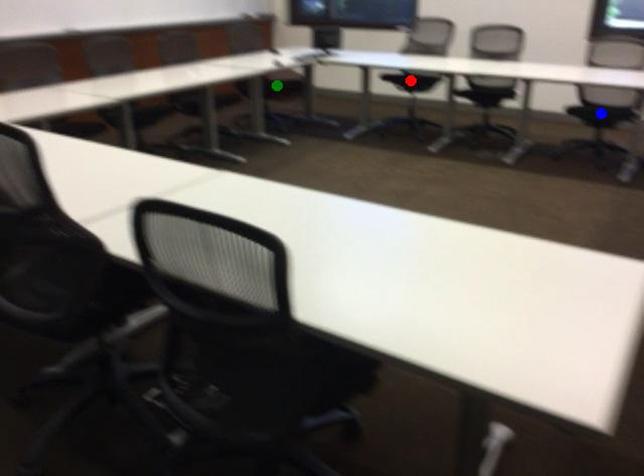
Order these from nearest to farthest:
green point, red point, blue point

green point < red point < blue point